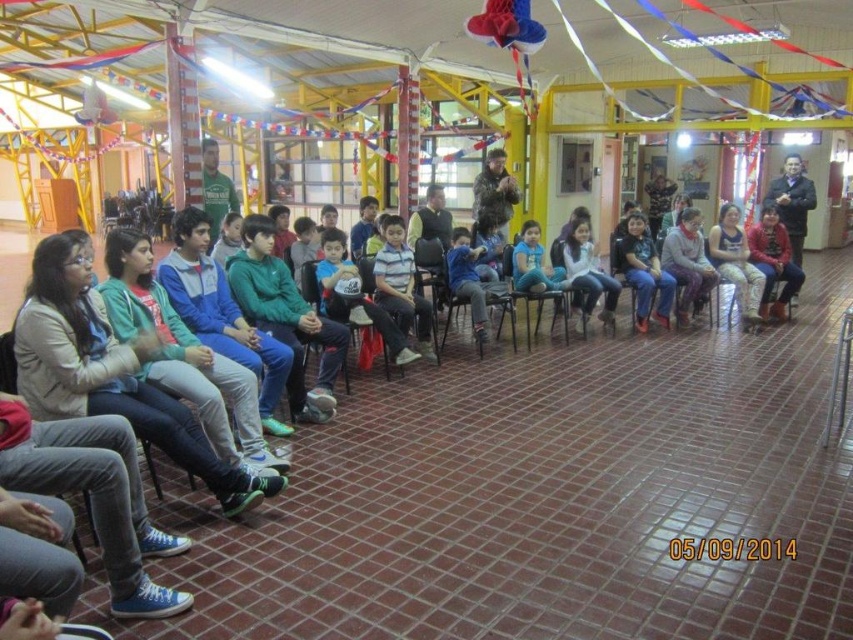
Where is the matte black shirt at center located in the image?

The matte black shirt at center is located at point coordinates of [643,272].

You are organizing a photo shoot and need to ensure that the two central figures in the image are positioned side by side without overlapping. Given that the matte black shirt at center and the red sweater at center are both at the center, which one should be moved to the side to accommodate the other?

The matte black shirt at center has a lesser width compared to the red sweater at center, so the matte black shirt at center should be moved to the side to make space for the wider red sweater at center.